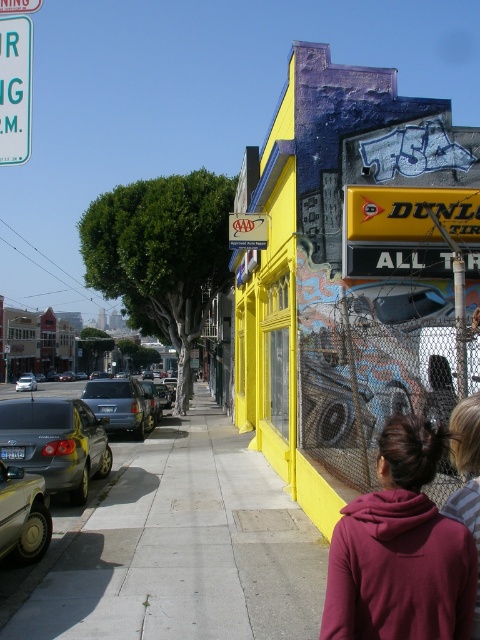
Question: Can you confirm if concrete sidewalk at center is bigger than silver metallic sedan at left?

Choices:
 (A) yes
 (B) no

Answer: (A)

Question: Which is farther from the concrete sidewalk at center?

Choices:
 (A) metallic gray sedan at left
 (B) shiny silver car at left
 (C) satin silver suv at center-left
 (D) metallic silver sedan at left

Answer: (A)

Question: Is metallic silver sedan at left to the right of metallic gray sedan at left from the viewer's perspective?

Choices:
 (A) yes
 (B) no

Answer: (B)

Question: Among these points, which one is farthest from the camera?

Choices:
 (A) (120, 508)
 (B) (56, 461)

Answer: (A)

Question: In this image, where is concrete sidewalk at center located relative to shiny silver car at left?

Choices:
 (A) below
 (B) above

Answer: (A)

Question: Estimate the real-world distances between objects in this image. Which object is closer to the concrete sidewalk at center?

Choices:
 (A) satin silver suv at center-left
 (B) metallic gray sedan at left
 (C) maroon hoodie at center

Answer: (A)